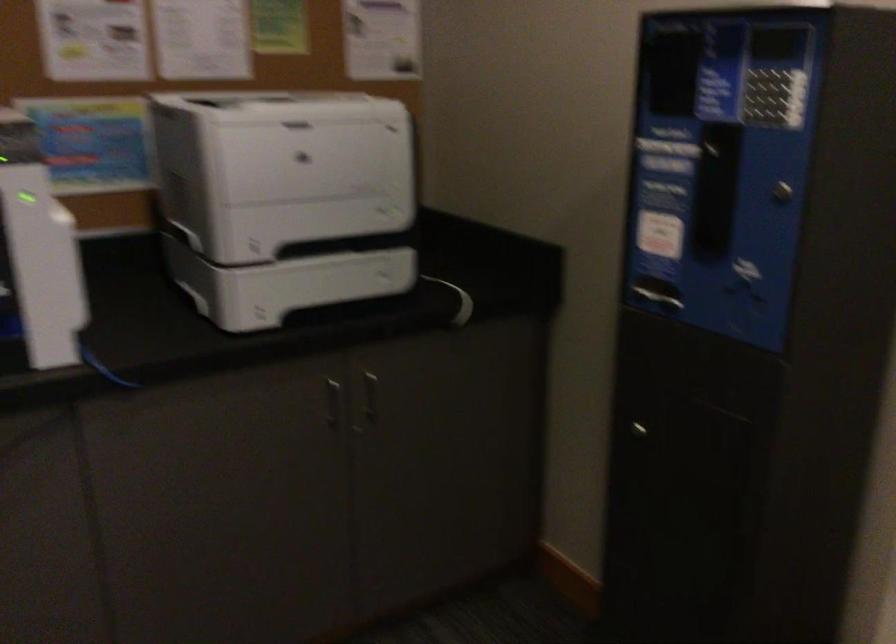
This screenshot has width=896, height=644. Identify the location of printer paper tray. (286, 283).